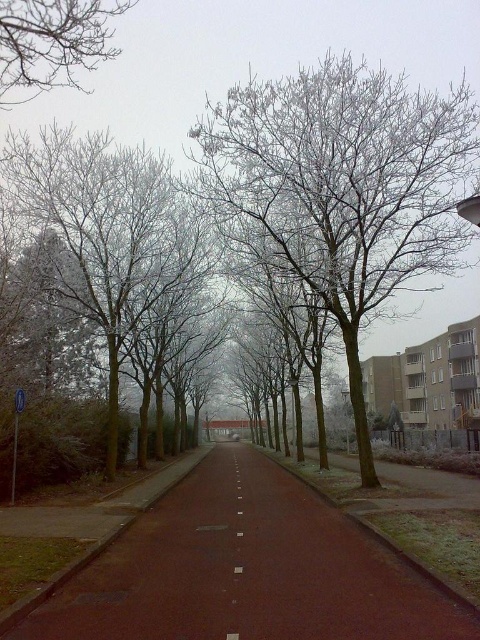
Looking at this image, you are standing on the pathway and want to take a photo of the white frosty tree at center and the white matte line at center. Which object will appear closer to the camera in the photo?

The white frosty tree at center will appear closer to the camera because it is positioned closer to the viewer than the white matte line at center.

You are standing on the pathway and want to take a photo of the white frosty tree at center and the white matte line at center. Which object should you position to your left side in the camera frame?

The white matte line at center should be positioned to your left side in the camera frame because the white frosty tree at center is to the right of it.

You are standing at the start of the pathway and want to take a photo of the white frosty tree at center. Which direction should you face to ensure the tree is in the center of your camera frame?

You should face directly towards the white frosty tree at center located at point coordinates [342,188] to center it in your camera frame.